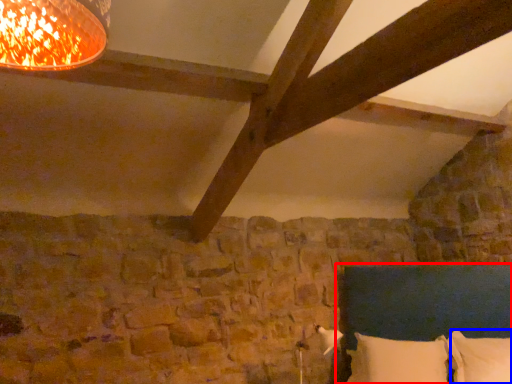
Question: Which of the following is the closest to the observer, bed (highlighted by a red box) or pillow (highlighted by a blue box)?

Choices:
 (A) bed
 (B) pillow

Answer: (A)